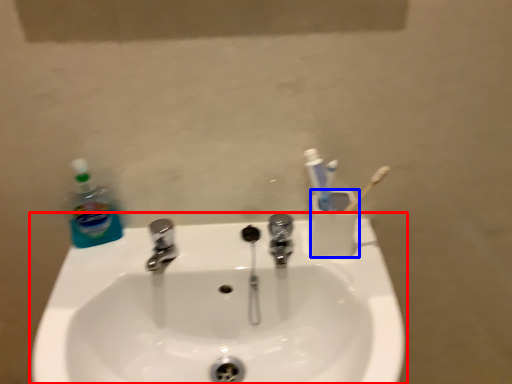
Question: Which of the following is the farthest to the observer, sink (highlighted by a red box) or liquid (highlighted by a blue box)?

Choices:
 (A) sink
 (B) liquid

Answer: (B)